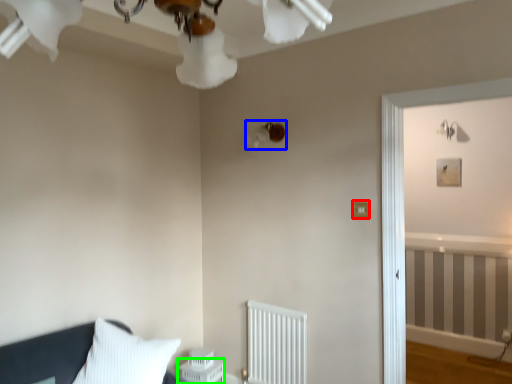
Question: Which object is the closest to the light switch (highlighted by a red box)? Choose among these: lamp (highlighted by a blue box) or table (highlighted by a green box).

Choices:
 (A) lamp
 (B) table

Answer: (A)